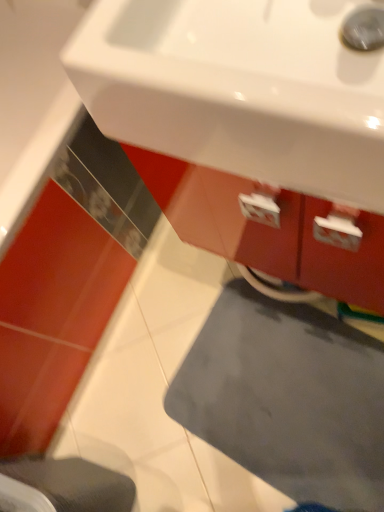
The height and width of the screenshot is (512, 384). I want to click on free space below gray matte bath mat at lower center (from a real-world perspective), so click(285, 396).